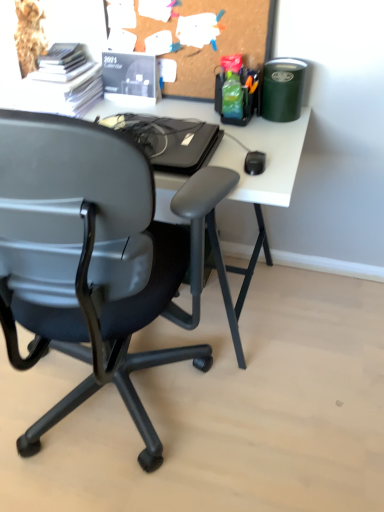
Locate an element on the screen. This screenshot has width=384, height=512. free space to the right of white paper stack at upper left, which appears as the fourth stationery when viewed from the right is located at coordinates (133, 106).